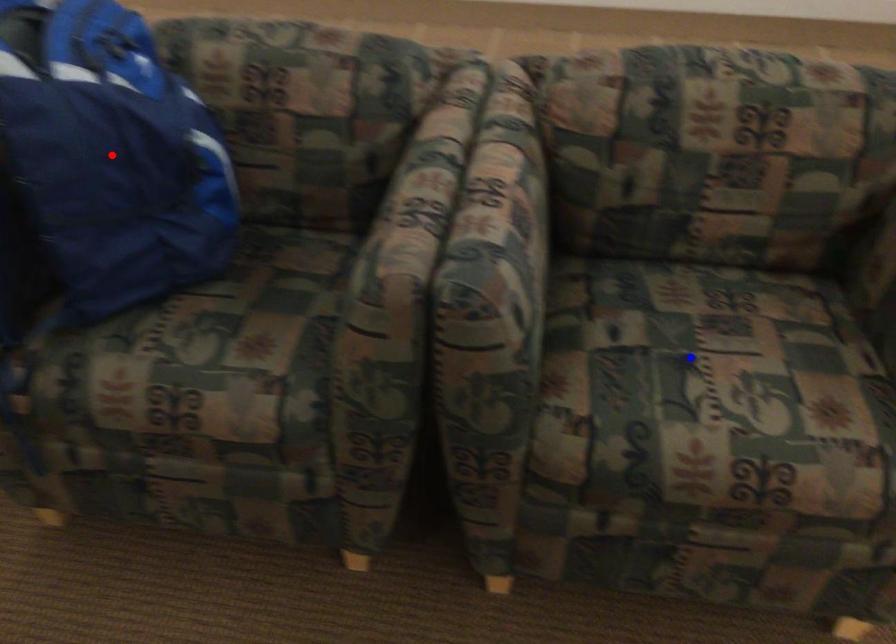
Question: Two points are marked on the image. Which point is closer to the camera?

Choices:
 (A) Blue point is closer.
 (B) Red point is closer.

Answer: (B)